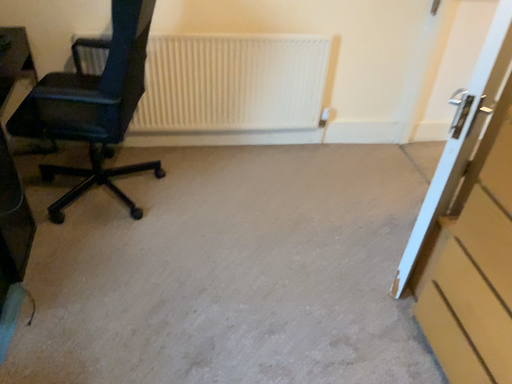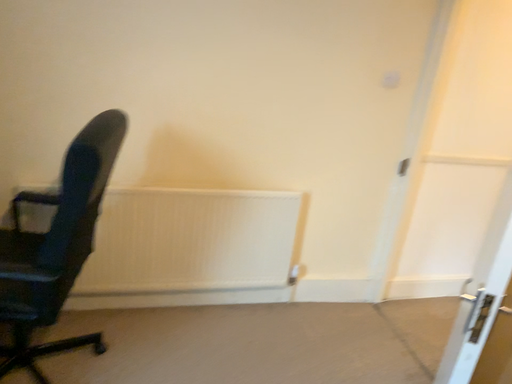
Question: Which way did the camera rotate in the video?

Choices:
 (A) rotated upward
 (B) rotated downward

Answer: (A)